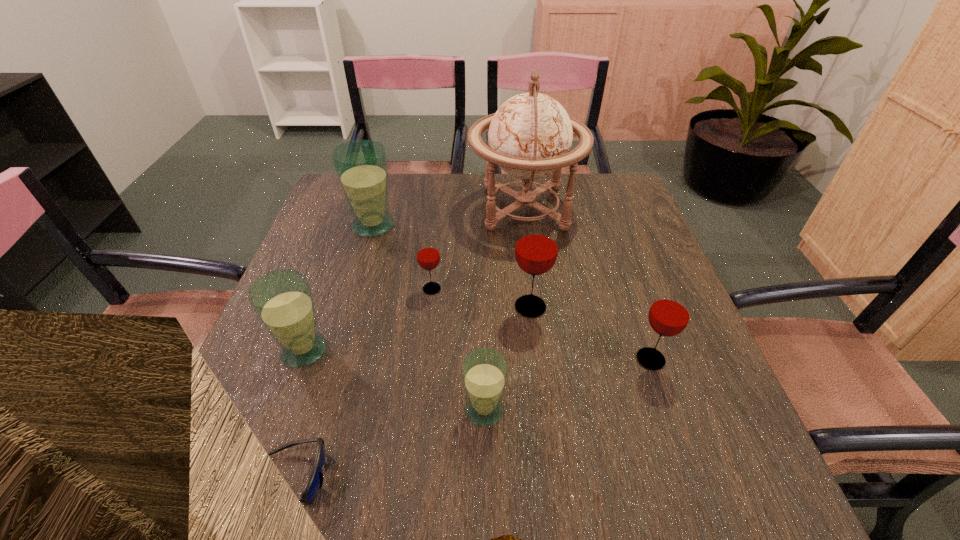
Find the location of a particular element. the tallest object is located at coordinates (530, 136).

Find the location of a particular element. This screenshot has height=540, width=960. the farthest glass is located at coordinates (361, 166).

Find the location of a particular element. the biggest blue glass is located at coordinates (361, 166).

Locate an element on the screen. the biggest red glass is located at coordinates (536, 249).

Identify the location of the second red glass from left to right. The image size is (960, 540). (536, 249).

This screenshot has width=960, height=540. I want to click on the second farthest blue glass, so click(x=282, y=299).

Find the location of a particular element. The image size is (960, 540). the nearest red glass is located at coordinates (670, 312).

I want to click on the rightmost red glass, so click(x=670, y=312).

The image size is (960, 540). In order to click on the third glass from left to right in this screenshot , I will do `click(428, 255)`.

The height and width of the screenshot is (540, 960). Find the location of `the leftmost red glass`. the leftmost red glass is located at coordinates (428, 255).